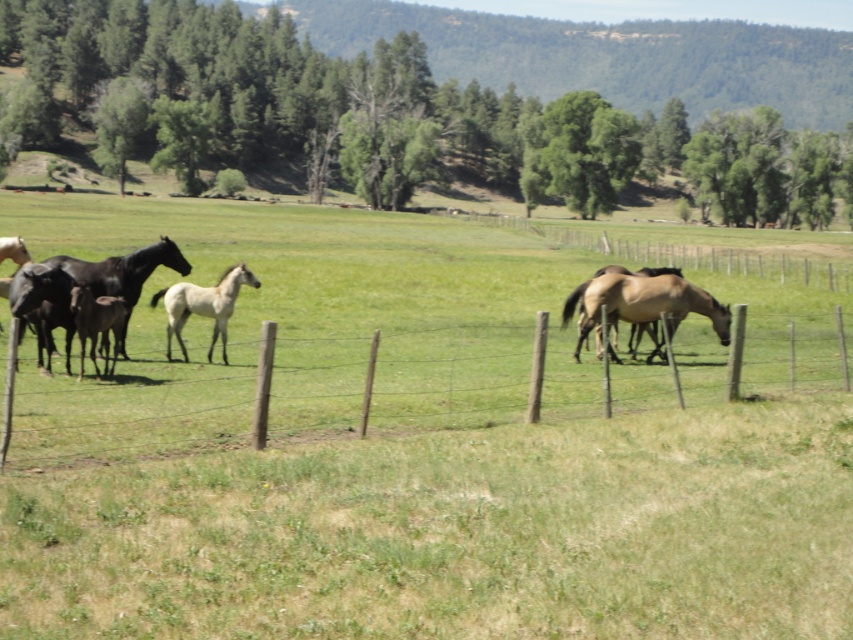
Which of these two, green grassy field at center or white glossy horse at center, stands taller?

Standing taller between the two is green grassy field at center.

Can you confirm if green grassy field at center is wider than white glossy horse at center?

Yes.

Is point (428, 600) closer to viewer compared to point (175, 310)?

Yes, point (428, 600) is closer to viewer.

Where is `green grassy field at center`? This screenshot has width=853, height=640. green grassy field at center is located at coordinates (416, 449).

Image resolution: width=853 pixels, height=640 pixels. Identify the location of green grassy field at center. (416, 449).

Can you confirm if green grassy field at center is bigger than dark brown glossy horse at left?

Yes, green grassy field at center is bigger than dark brown glossy horse at left.

The width and height of the screenshot is (853, 640). What do you see at coordinates (416, 449) in the screenshot? I see `green grassy field at center` at bounding box center [416, 449].

Where is `green grassy field at center`? green grassy field at center is located at coordinates (416, 449).

Is wooden post fence at lower center to the left of brown glossy horse at center from the viewer's perspective?

Indeed, wooden post fence at lower center is positioned on the left side of brown glossy horse at center.

Does point (729, 474) come behind point (659, 298)?

No.

Locate an element on the screen. wooden post fence at lower center is located at coordinates pos(440,410).